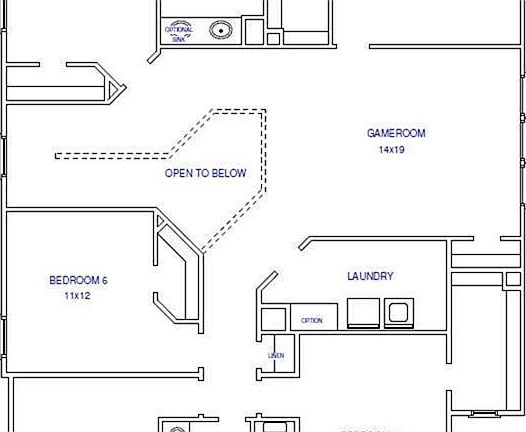
Locate an element on the screen. bedroom is located at coordinates (106, 261).